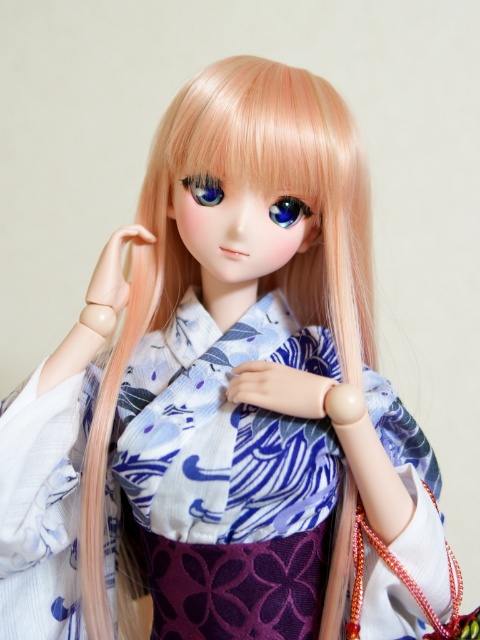
Looking at this image, you are an artist examining the doll and its kimono. You notice two eyes on the doll. Which eye is smaller in size between the glossy blue eye at center and the blue glossy eye at center?

The glossy blue eye at center has a smaller size compared to the blue glossy eye at center.

You are an artist trying to paint the doll from the image. You need to place the glossy blue eye at center accurately. According to the coordinates provided, where should you position it?

The glossy blue eye at center should be positioned at coordinates point (288, 211).